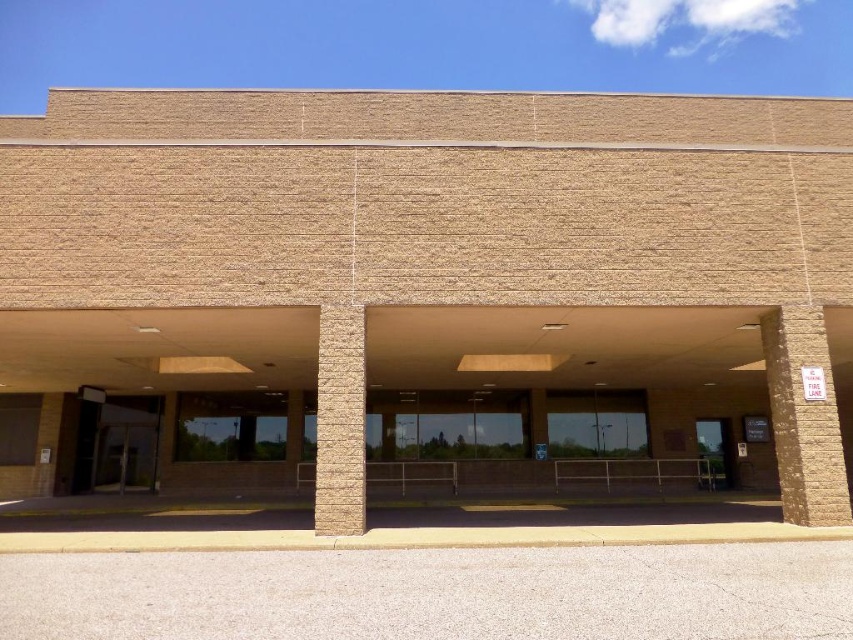
From the picture: You are a contractor assessing the building structure. You notice the brown brick pillar at right and beige textured pillar at center. Which pillar has a greater width?

The brown brick pillar at right might be wider than beige textured pillar at center according to the description.